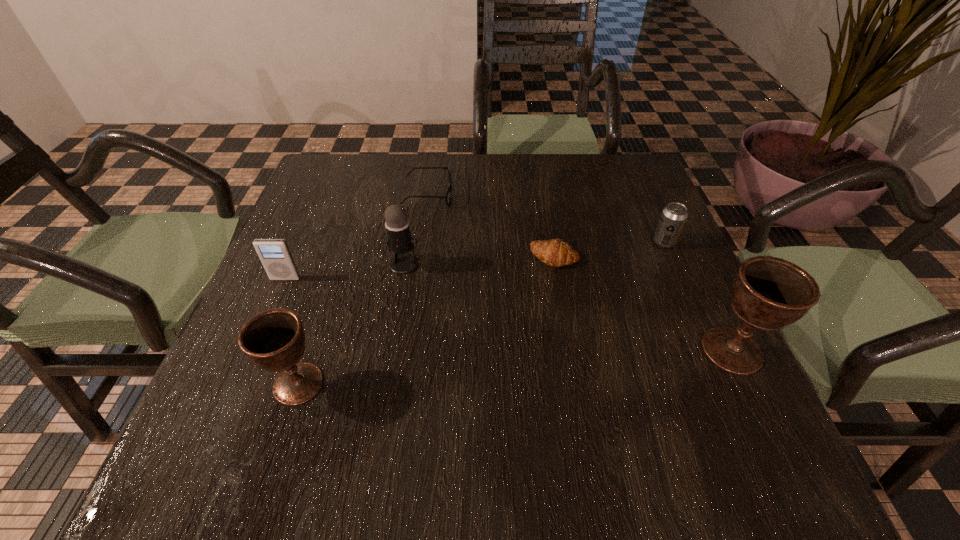
Where is `the sixth object from right to left`? This screenshot has width=960, height=540. the sixth object from right to left is located at coordinates (274, 340).

What are the coordinates of `the shorter chalice` in the screenshot? It's located at (274, 340).

The width and height of the screenshot is (960, 540). Identify the location of the taller chalice. (768, 293).

You are a GUI agent. You are given a task and a screenshot of the screen. Output one action in this format:
    pyautogui.click(x=<x>, y=<y>)
    Task: Click on the microphone
    Image resolution: width=960 pixels, height=540 pixels.
    Given the screenshot: What is the action you would take?
    [399, 240]

The image size is (960, 540). Find the location of `spectacles`. spectacles is located at coordinates tap(447, 197).

Locate an element on the screen. The image size is (960, 540). crescent roll is located at coordinates (556, 253).

Locate an element on the screen. beer can is located at coordinates (673, 217).

Image resolution: width=960 pixels, height=540 pixels. I want to click on the fifth farthest object, so click(x=274, y=254).

At what (x,y) coordinates should I click in order to perform the action: click on iPod. Please return your answer as a coordinate pair (x, y). Looking at the image, I should click on (274, 254).

You are a GUI agent. You are given a task and a screenshot of the screen. Output one action in this format:
    pyautogui.click(x=<x>, y=<y>)
    Task: Click on the vacant position located 0.180m on the back of the shorter chalice
    The image size is (960, 540).
    Given the screenshot: What is the action you would take?
    pyautogui.click(x=329, y=288)